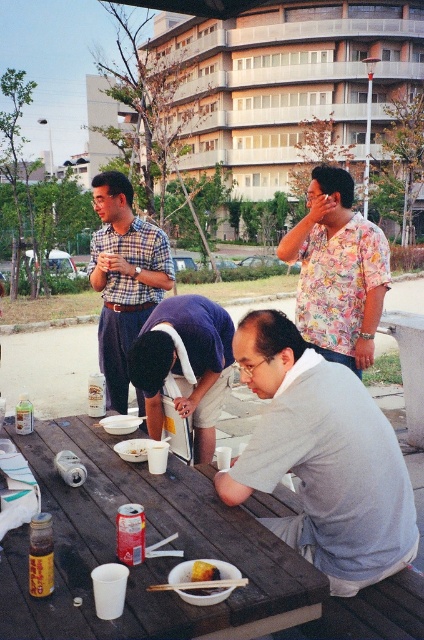
You are organizing a picnic cleanup and need to decide which item to pack first. Based on their sizes, which item between the gray matte shirt at lower right and the brown crumbly cake at center should you handle first to ensure proper packing?

The gray matte shirt at lower right has a larger size compared to the brown crumbly cake at center, so you should pack the gray matte shirt at lower right first to accommodate its size in the packing space.

You are a person who needs to grab a snack from the white paper bowl at table center but you are currently standing near the plaid shirt at upper left. Can you reach the bowl without moving your feet?

The plaid shirt at upper left and white paper bowl at table center are 1.21 meters apart from each other. Since the average human arm span is about 1.5 meters, you could potentially reach the bowl without moving your feet if you stretch your arm fully.